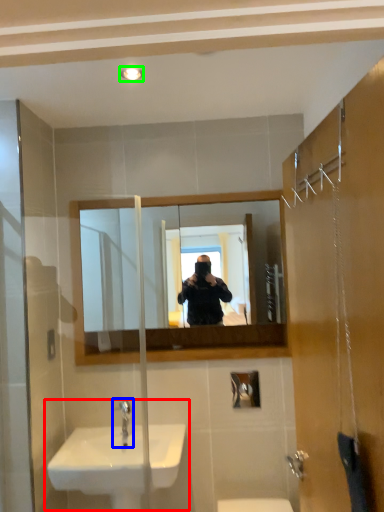
Question: Which object is the farthest from sink (highlighted by a red box)? Choose among these: tap (highlighted by a blue box) or light fixture (highlighted by a green box).

Choices:
 (A) tap
 (B) light fixture

Answer: (B)